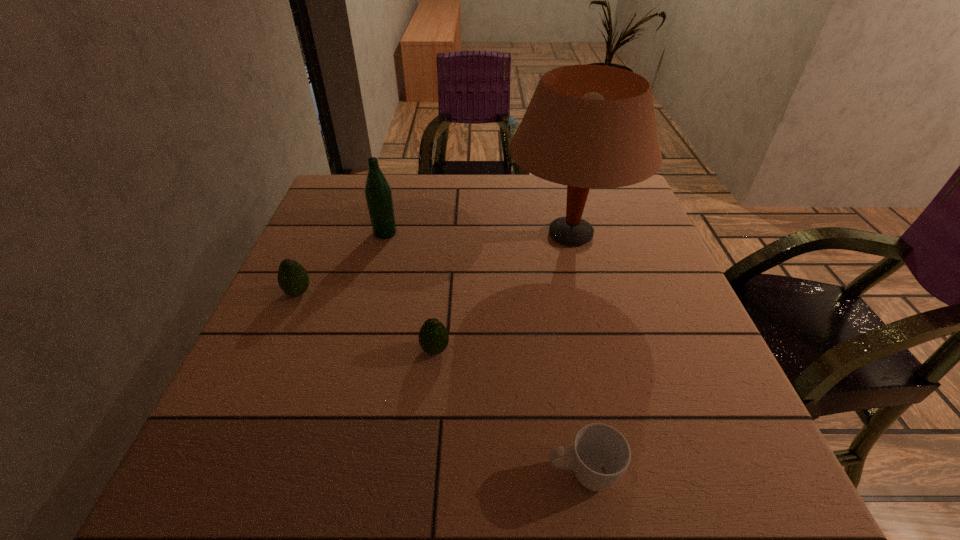
This screenshot has height=540, width=960. Find the location of `unoccupied position between the cup and the third nearest object`. unoccupied position between the cup and the third nearest object is located at coordinates (441, 383).

Where is `empty space that is in between the nearest object and the right avocado`? This screenshot has width=960, height=540. empty space that is in between the nearest object and the right avocado is located at coordinates (509, 412).

Image resolution: width=960 pixels, height=540 pixels. In order to click on free space between the nearer avocado and the left avocado in this screenshot , I will do `click(367, 321)`.

Identify the location of free spot between the cup and the nearer avocado. (509, 412).

Find the location of a particular element. The image size is (960, 540). free area in between the fourth object from right to left and the nearest object is located at coordinates (484, 354).

Locate an element on the screen. Image resolution: width=960 pixels, height=540 pixels. vacant area that lies between the tallest object and the leftmost object is located at coordinates (434, 264).

Identify the location of free spot between the nearest object and the left avocado. (441, 383).

Locate an element on the screen. This screenshot has width=960, height=540. object that is the second nearest to the nearer avocado is located at coordinates (600, 454).

Find the location of a particular element. The image size is (960, 540). object identified as the second closest to the right avocado is located at coordinates (600, 454).

Locate an element on the screen. free space that satisfies the following two spatial constraints: 1. on the front side of the third object from left to right; 2. on the left side of the third farthest object is located at coordinates (274, 350).